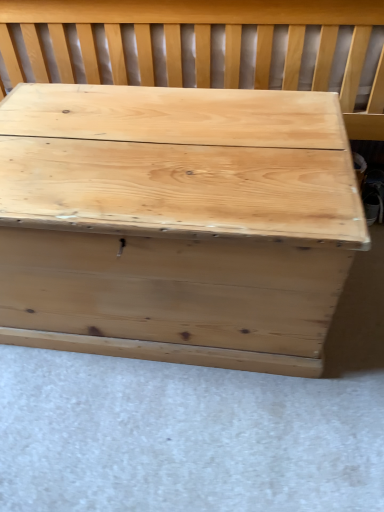
What are the coordinates of `free space above natural wood trunk at center (from a real-world perspective)` in the screenshot? It's located at pyautogui.click(x=168, y=140).